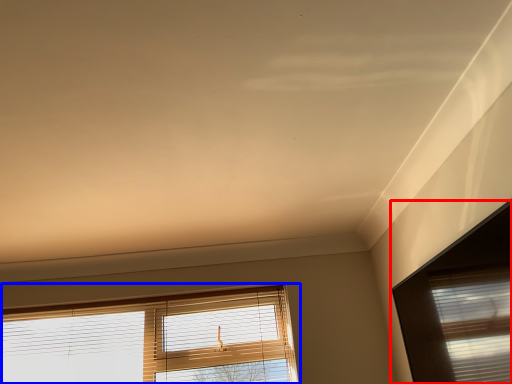
Question: Which point is closer to the camera, window (highlighted by a red box) or window (highlighted by a blue box)?

Choices:
 (A) window
 (B) window

Answer: (A)